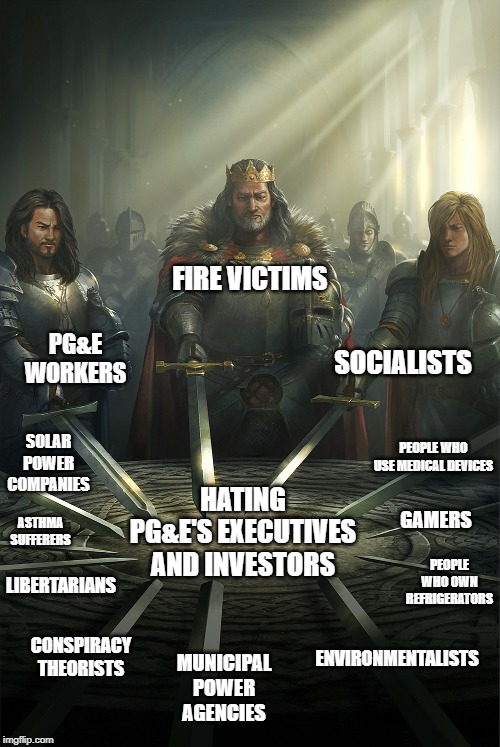
The width and height of the screenshot is (500, 747). In order to click on table in this screenshot , I will do `click(294, 609)`.